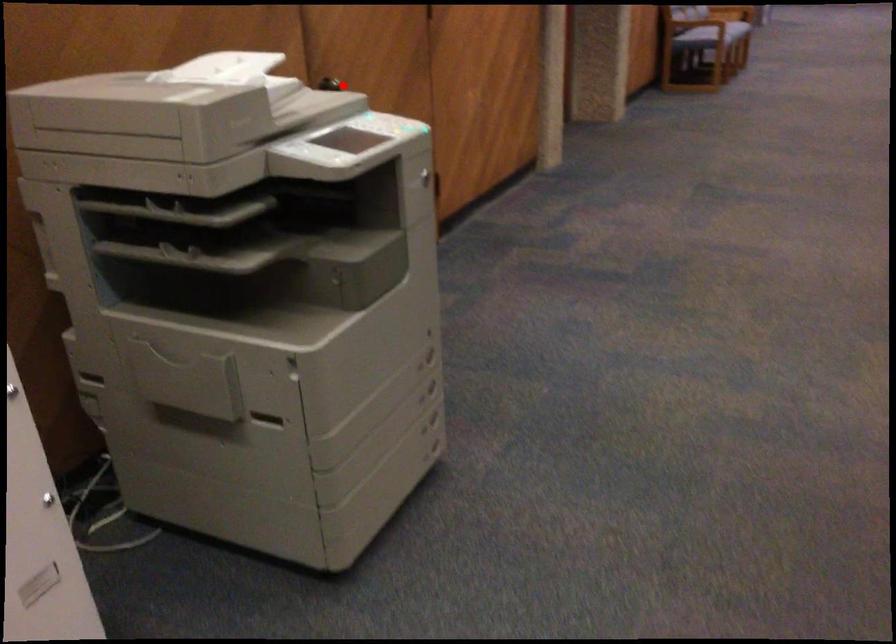
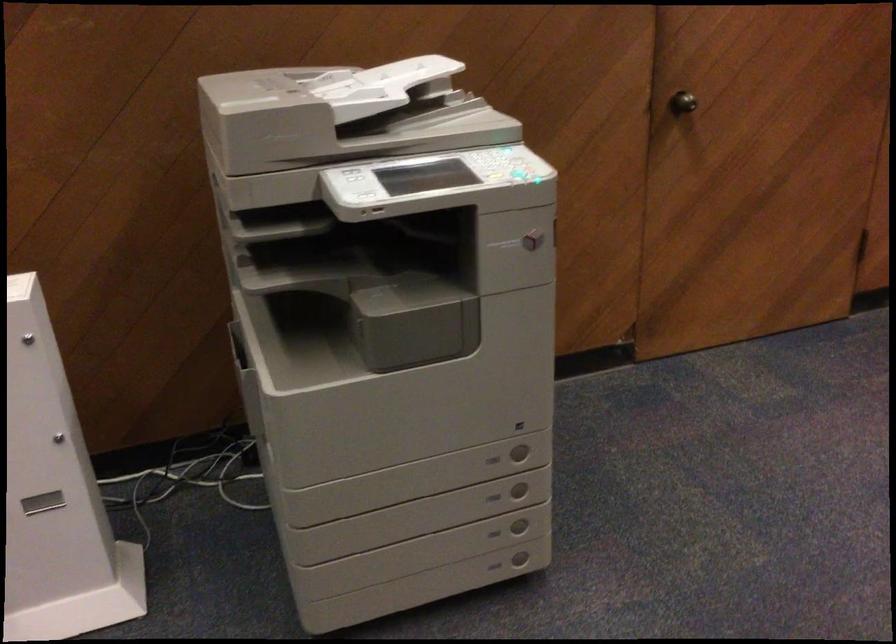
Question: I am providing you with two images of the same scene from different viewpoints. Given a red point in image1, look at the same physical point in image2. Is it:

Choices:
 (A) Closer to the viewpoint
 (B) Farther from the viewpoint

Answer: (A)